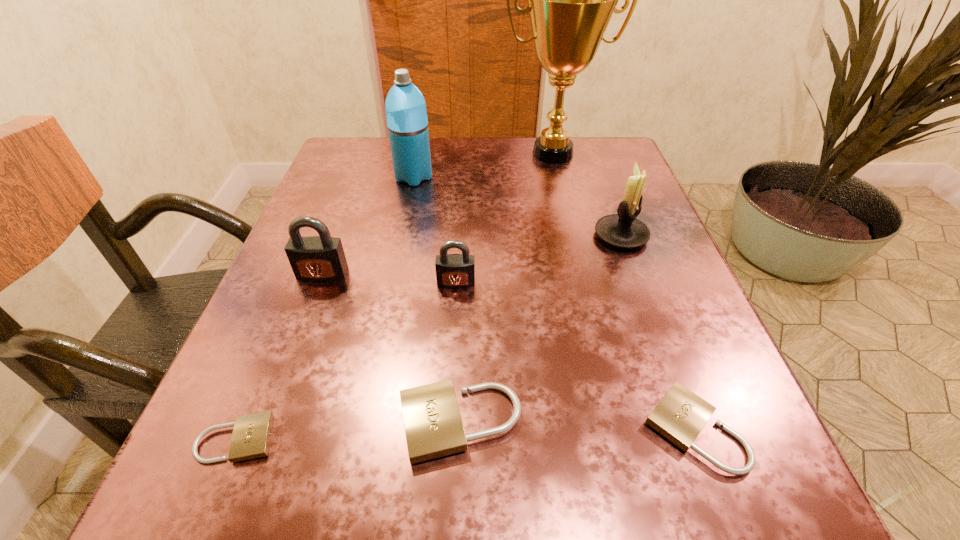
You are a GUI agent. You are given a task and a screenshot of the screen. Output one action in this format:
    pyautogui.click(x=<x>, y=<y>)
    Task: Click on the vacant space that satisfies the following two spatial constraints: 1. on the front of the sixth tallest object near the keyhole; 2. on the left side of the right gray padlock
    
    Given the screenshot: What is the action you would take?
    pyautogui.click(x=448, y=422)

The width and height of the screenshot is (960, 540). In order to click on blank area in the image that satisfies the following two spatial constraints: 1. on the front of the second beige padlock from left to right near the keyhole; 2. on the left side of the tallest padlock in this screenshot , I will do `click(267, 422)`.